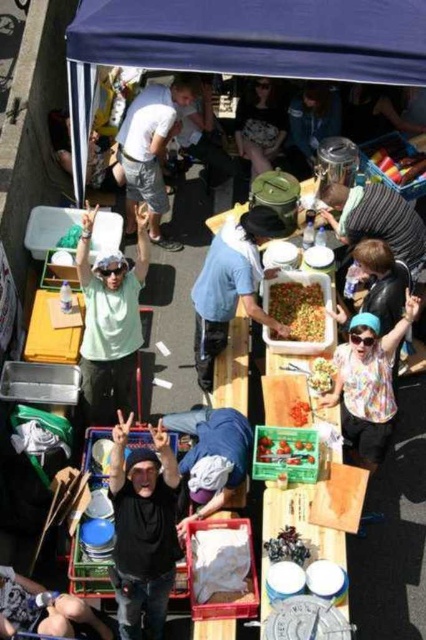
Question: Which point is closer to the camera taking this photo?

Choices:
 (A) (380, 172)
 (B) (132, 205)

Answer: (A)

Question: Is blue fabric canopy at upper center further to the viewer compared to smooth red strawberries at center?

Choices:
 (A) no
 (B) yes

Answer: (B)

Question: Which point is farther to the camera?

Choices:
 (A) shiny dark chocolate at center
 (B) matte black helmet at upper center
 (C) blue fabric at center
 (D) shiny red plastic container at center

Answer: (B)

Question: Among these points, which one is nearest to the camera?

Choices:
 (A) (382, 429)
 (B) (327, 380)
 (C) (412, 218)
 (D) (282, 314)

Answer: (A)

Question: Is black matte shirt at center in front of blue denim jacket at center?

Choices:
 (A) no
 (B) yes

Answer: (B)

Question: Is blue fabric at center wider than white cotton shirt at upper center?

Choices:
 (A) yes
 (B) no

Answer: (A)